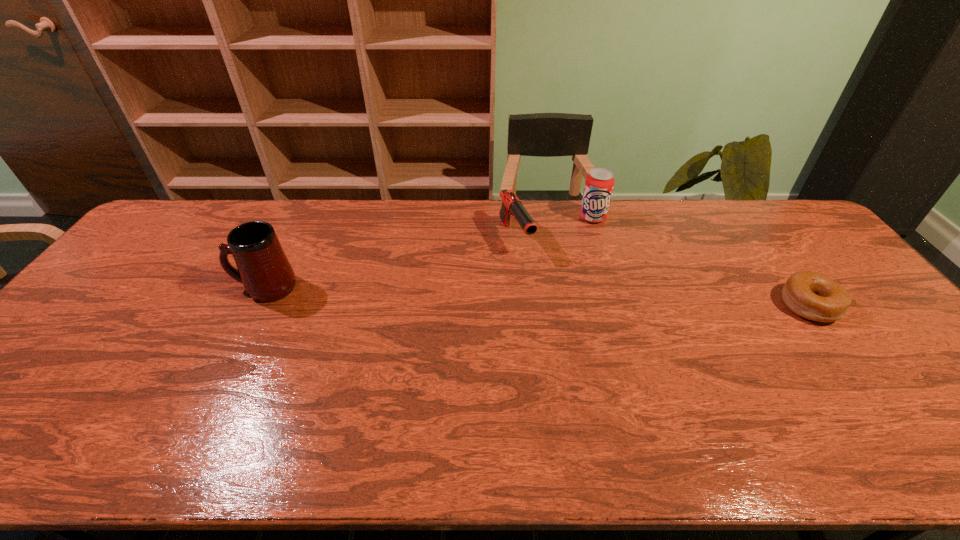
Locate an element on the screen. The width and height of the screenshot is (960, 540). free spot located at the aiming end of the third tallest object is located at coordinates (579, 348).

Find the location of `free location located at the aiming end of the third tallest object`. free location located at the aiming end of the third tallest object is located at coordinates (567, 331).

The height and width of the screenshot is (540, 960). I want to click on vacant space situated at the aiming end of the third tallest object, so click(x=564, y=325).

Locate an element on the screen. The height and width of the screenshot is (540, 960). free space located on the surface of the soda can is located at coordinates (562, 301).

The image size is (960, 540). Find the location of `vacant space located 0.100m on the surface of the soda can`. vacant space located 0.100m on the surface of the soda can is located at coordinates (584, 242).

Locate an element on the screen. free location located 0.290m on the surface of the soda can is located at coordinates (570, 279).

Locate an element on the screen. gun that is at the far edge is located at coordinates (511, 206).

The width and height of the screenshot is (960, 540). Find the location of `soda can at the far edge`. soda can at the far edge is located at coordinates (599, 183).

The height and width of the screenshot is (540, 960). I want to click on object at the right edge, so click(x=812, y=295).

This screenshot has height=540, width=960. Find the location of `blank space at the far edge of the desktop`. blank space at the far edge of the desktop is located at coordinates (759, 235).